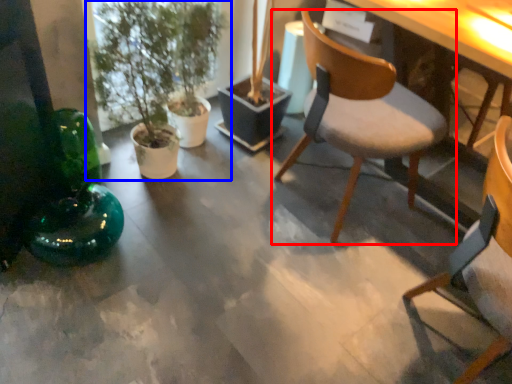
Question: Which object appears farthest to the camera in this image, chair (highlighted by a red box) or houseplant (highlighted by a blue box)?

Choices:
 (A) chair
 (B) houseplant

Answer: (B)